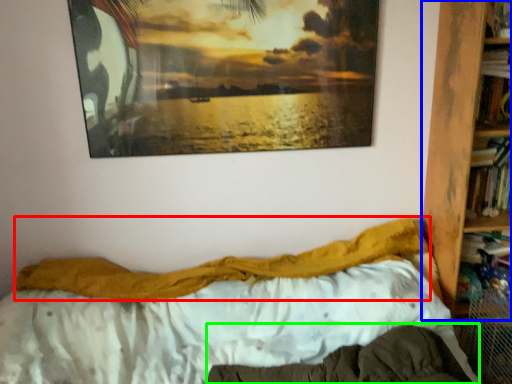
Question: Estimate the real-world distances between objects in this image. Which object is closer to blanket (highlighted by a red box), bookcase (highlighted by a blue box) or mattress (highlighted by a green box)?

Choices:
 (A) bookcase
 (B) mattress

Answer: (B)